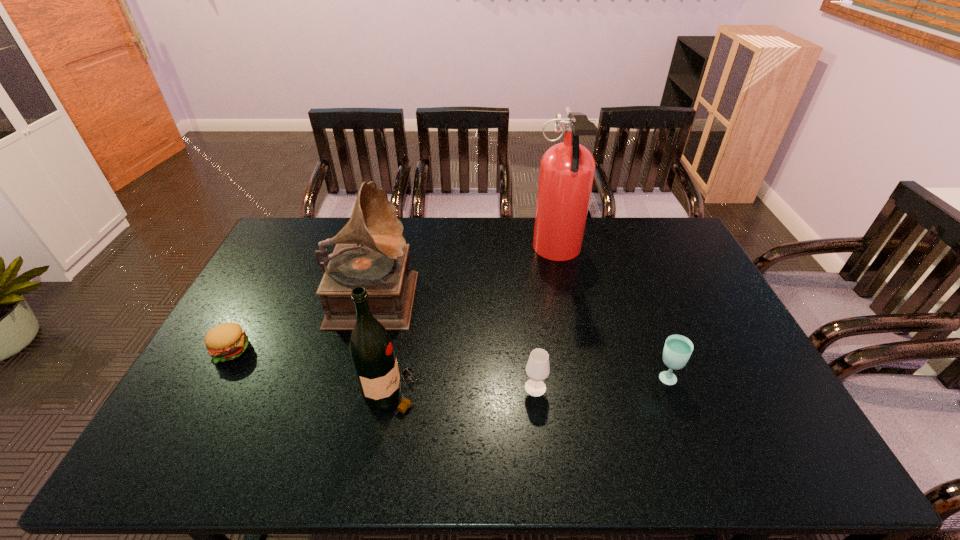
Find the location of a particular element. vacant space situated on the surface of the wine bottle is located at coordinates (476, 393).

Locate an element on the screen. vacant space located 0.250m on the back of the right glass is located at coordinates (637, 305).

Where is `vacant point located on the front of the third object from right to left`? The width and height of the screenshot is (960, 540). vacant point located on the front of the third object from right to left is located at coordinates (539, 418).

The height and width of the screenshot is (540, 960). In order to click on free region located on the right of the hamburger in this screenshot , I will do `click(390, 349)`.

Where is `object that is at the far edge`? This screenshot has width=960, height=540. object that is at the far edge is located at coordinates (567, 169).

This screenshot has width=960, height=540. In order to click on object that is at the left edge in this screenshot , I will do `click(227, 341)`.

In the image, there is a desktop. Where is `vacant space at the far edge`? vacant space at the far edge is located at coordinates (591, 246).

Locate an element on the screen. Image resolution: width=960 pixels, height=540 pixels. vacant region at the near edge is located at coordinates (x=605, y=460).

In the image, there is a desktop. Identify the location of vacant space at the left edge. Image resolution: width=960 pixels, height=540 pixels. (269, 305).

Where is `vacant space at the right edge of the desktop`? vacant space at the right edge of the desktop is located at coordinates (693, 321).